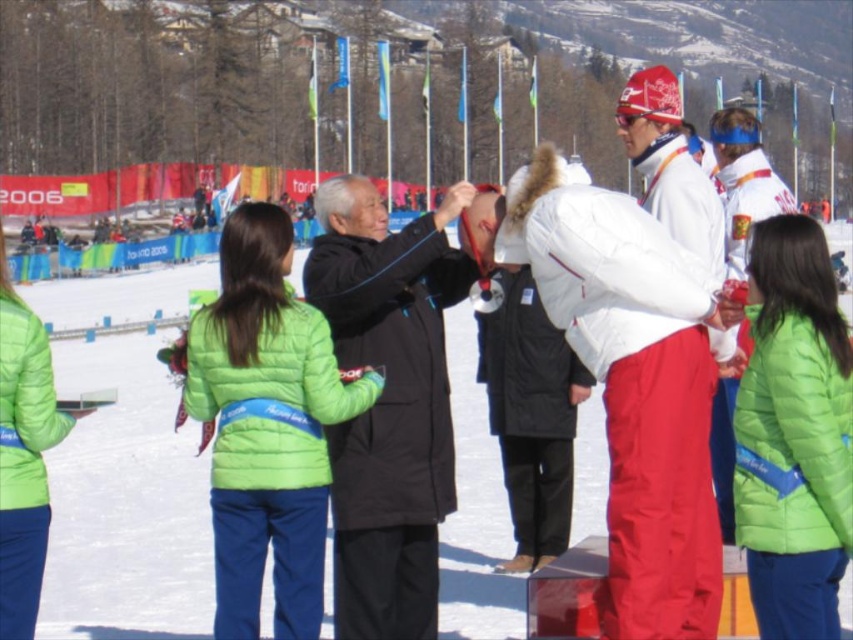
Question: Is white snow at center further to the viewer compared to green matte jacket at center?

Choices:
 (A) no
 (B) yes

Answer: (B)

Question: Does white snow at center appear on the left side of white matte jacket at center?

Choices:
 (A) no
 (B) yes

Answer: (B)

Question: Which is farther from the black matte jacket at center?

Choices:
 (A) green matte jacket at center
 (B) white snow at center

Answer: (B)

Question: Which object is closer to the camera taking this photo?

Choices:
 (A) white snow at center
 (B) black matte jacket at center
 (C) white matte jacket at center
 (D) green matte jacket at center

Answer: (C)

Question: Does black matte jacket at center have a lesser width compared to green matte jacket at center?

Choices:
 (A) no
 (B) yes

Answer: (B)

Question: Estimate the real-world distances between objects in this image. Which object is farther from the green matte jacket at center?

Choices:
 (A) white snow at center
 (B) black matte jacket at center

Answer: (A)